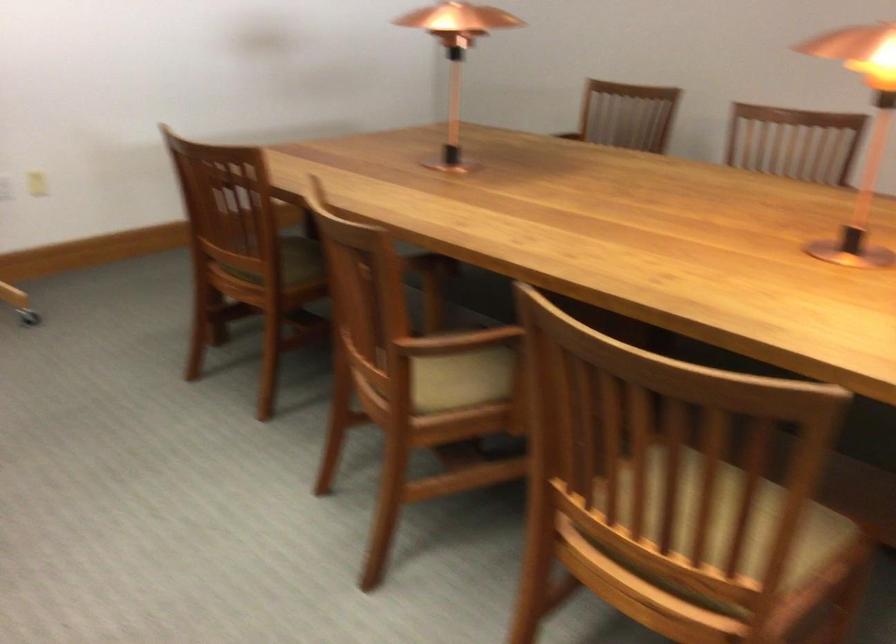
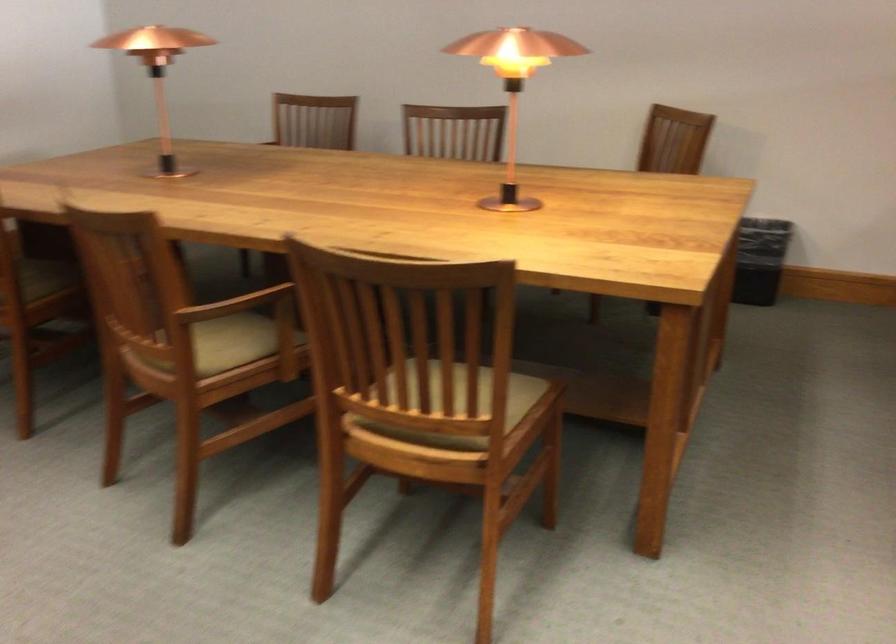
Question: The camera is either moving clockwise (left) or counter-clockwise (right) around the object. The first image is from the beginning of the video and the second image is from the end. Is the camera moving left or right when shooting the video?

Choices:
 (A) Left
 (B) Right

Answer: (A)